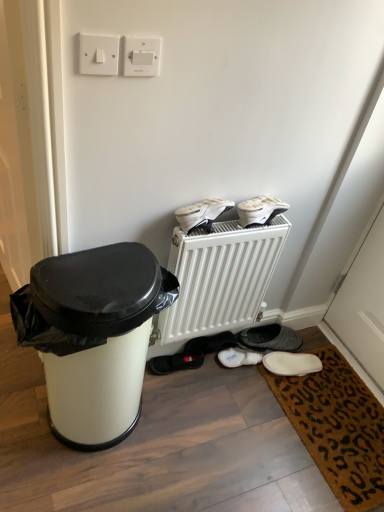
Question: Is white plastic switch at upper left, which appears as the second electric outlet when viewed from the right, oriented towards white plastic radiator at center?

Choices:
 (A) yes
 (B) no

Answer: (B)

Question: Considering the relative sizes of white plastic switch at upper left, which appears as the second electric outlet when viewed from the right, and white plastic radiator at center in the image provided, is white plastic switch at upper left, which appears as the second electric outlet when viewed from the right, taller than white plastic radiator at center?

Choices:
 (A) yes
 (B) no

Answer: (B)

Question: Is white plastic switch at upper left, the 1th electric outlet from the left, directly adjacent to white plastic radiator at center?

Choices:
 (A) yes
 (B) no

Answer: (B)

Question: Can you confirm if white plastic switch at upper left, the 1th electric outlet from the left, is shorter than white plastic radiator at center?

Choices:
 (A) no
 (B) yes

Answer: (B)

Question: Does white plastic switch at upper left, which appears as the second electric outlet when viewed from the right, have a greater width compared to white plastic radiator at center?

Choices:
 (A) yes
 (B) no

Answer: (B)

Question: From a real-world perspective, is white plastic switch at upper left, the 1th electric outlet from the left, physically below white plastic radiator at center?

Choices:
 (A) no
 (B) yes

Answer: (A)

Question: Would you consider white matte sneakers at upper center, which is counted as the second footwear, starting from the front, to be distant from white matte plastic trash can at left?

Choices:
 (A) yes
 (B) no

Answer: (B)

Question: Does white matte sneakers at upper center, arranged as the 2th footwear when viewed from the back, have a smaller size compared to white matte plastic trash can at left?

Choices:
 (A) no
 (B) yes

Answer: (B)

Question: Is white matte sneakers at upper center, the first footwear from the top, located outside white matte plastic trash can at left?

Choices:
 (A) yes
 (B) no

Answer: (A)

Question: Is white matte plastic trash can at left at the back of white matte sneakers at upper center, the first footwear from the top?

Choices:
 (A) no
 (B) yes

Answer: (A)

Question: From the image's perspective, does white matte sneakers at upper center, which is counted as the second footwear, starting from the front, appear lower than white matte plastic trash can at left?

Choices:
 (A) no
 (B) yes

Answer: (A)

Question: Can you confirm if white matte sneakers at upper center, arranged as the 2th footwear when viewed from the back, is wider than white matte plastic trash can at left?

Choices:
 (A) no
 (B) yes

Answer: (A)

Question: Is white matte sneakers at upper center, which ranks as the third footwear in bottom-to-top order, smaller than white plastic radiator at center?

Choices:
 (A) no
 (B) yes

Answer: (B)